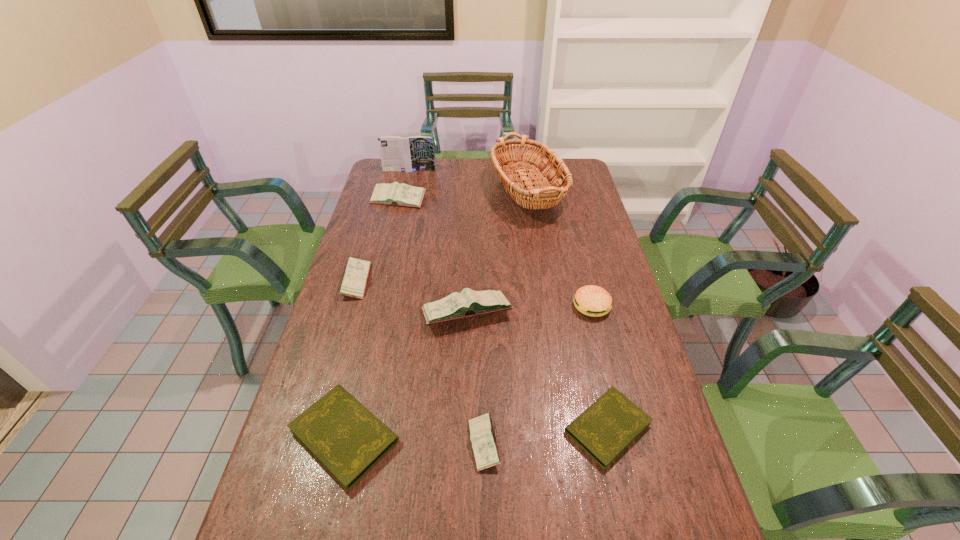
Find the location of a particular element. The width and height of the screenshot is (960, 540). the fifth tallest diary is located at coordinates tap(344, 436).

Locate an element on the screen. The height and width of the screenshot is (540, 960). the bigger green diary is located at coordinates (344, 436).

The height and width of the screenshot is (540, 960). In order to click on the smaller green diary in this screenshot , I will do (605, 429).

Identify the location of the shortest object. (605, 429).

This screenshot has height=540, width=960. In order to click on vacant region located 0.080m on the left of the basket in this screenshot , I will do `click(453, 196)`.

Where is `vacant space located 0.320m on the front cover of the second tallest object`? The width and height of the screenshot is (960, 540). vacant space located 0.320m on the front cover of the second tallest object is located at coordinates (399, 213).

The height and width of the screenshot is (540, 960). What are the coordinates of `vacant area situated on the right of the tallest diary` in the screenshot? It's located at (562, 313).

Find the location of a particular element. free region located 0.330m on the right of the farthest pink diary is located at coordinates (507, 200).

Identify the location of free location located 0.120m on the left of the patty. The image size is (960, 540). (535, 306).

The width and height of the screenshot is (960, 540). In order to click on vacant space located 0.180m on the back of the third tallest diary in this screenshot , I will do `click(372, 232)`.